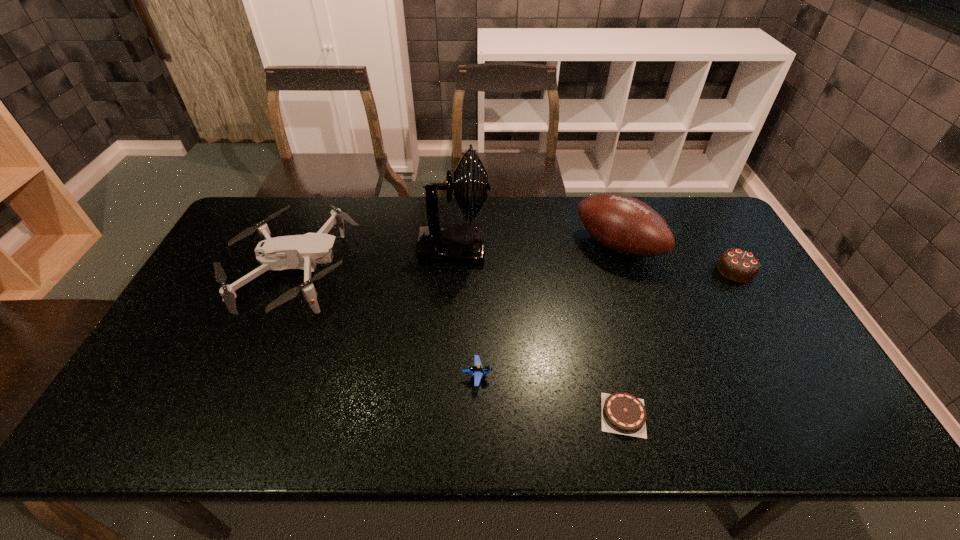
The width and height of the screenshot is (960, 540). I want to click on vacant region that satisfies the following two spatial constraints: 1. on the back side of the taller chocolate cake; 2. in front of the tallest object to blow air, so click(722, 246).

The width and height of the screenshot is (960, 540). I want to click on free space that satisfies the following two spatial constraints: 1. with a camera at the front of the shorter chocolate cake; 2. on the left side of the fourth shortest object, so click(x=233, y=415).

The height and width of the screenshot is (540, 960). Identify the location of vacant space that satisfies the following two spatial constraints: 1. on the front side of the fifth shortest object; 2. in front of the fan to blow air. (618, 246).

Where is `blank area in the image that satisfies the following two spatial constraints: 1. on the front-facing side of the nearer chocolate cake; 2. on the left side of the Lego`? blank area in the image that satisfies the following two spatial constraints: 1. on the front-facing side of the nearer chocolate cake; 2. on the left side of the Lego is located at coordinates (477, 415).

You are a GUI agent. You are given a task and a screenshot of the screen. Output one action in this format:
    pyautogui.click(x=<x>, y=<y>)
    Task: Click on the vacant space that satisfies the following two spatial constraints: 1. with a camera at the front of the leftmost object; 2. on the right side of the nearer chocolate cake
    The image size is (960, 540).
    Given the screenshot: What is the action you would take?
    pyautogui.click(x=233, y=415)

This screenshot has width=960, height=540. Find the location of `free spot that satisfies the following two spatial constraints: 1. on the back side of the left chocolate cake; 2. in front of the tallest object to blow air`. free spot that satisfies the following two spatial constraints: 1. on the back side of the left chocolate cake; 2. in front of the tallest object to blow air is located at coordinates (582, 246).